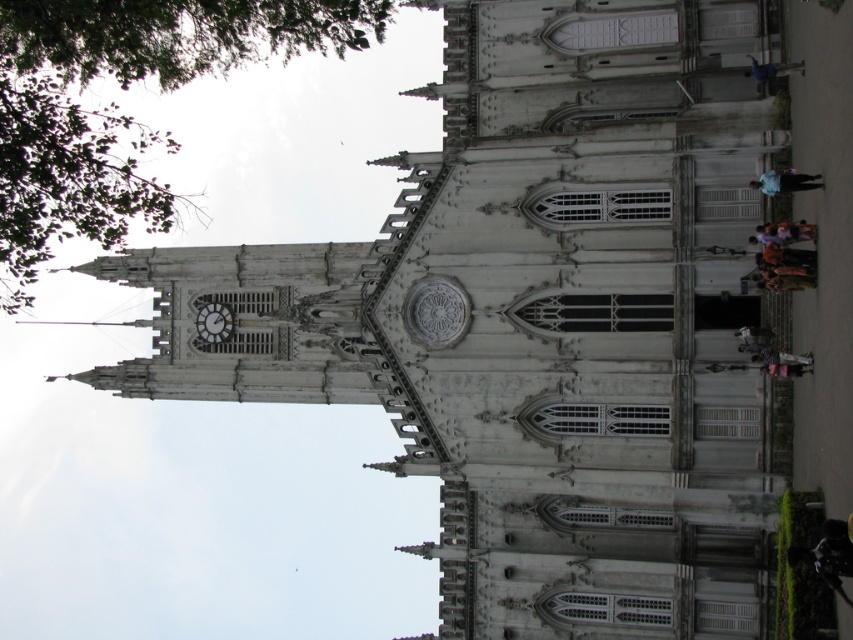
Is orange fabric at right smaller than light brown wooden chair at lower right?

Actually, orange fabric at right might be larger than light brown wooden chair at lower right.

Can you confirm if orange fabric at right is positioned below light brown wooden chair at lower right?

No.

Locate an element on the screen. orange fabric at right is located at coordinates (788, 257).

Which of these two, green leafy tree at upper left or orange fabric at right, stands shorter?

orange fabric at right is shorter.

Describe the element at coordinates (119, 109) in the screenshot. I see `green leafy tree at upper left` at that location.

Describe the element at coordinates (119, 109) in the screenshot. I see `green leafy tree at upper left` at that location.

At what (x,y) coordinates should I click in order to perform the action: click on green leafy tree at upper left. Please return your answer as a coordinate pair (x, y). The width and height of the screenshot is (853, 640). Looking at the image, I should click on (119, 109).

Looking at this image, is blue fabric at upper right below orange fabric at right?

No, blue fabric at upper right is not below orange fabric at right.

What do you see at coordinates (770, 72) in the screenshot? I see `blue fabric at upper right` at bounding box center [770, 72].

Is point (773, 77) less distant than point (769, 250)?

No.

Where is `blue fabric at upper right`? blue fabric at upper right is located at coordinates (770, 72).